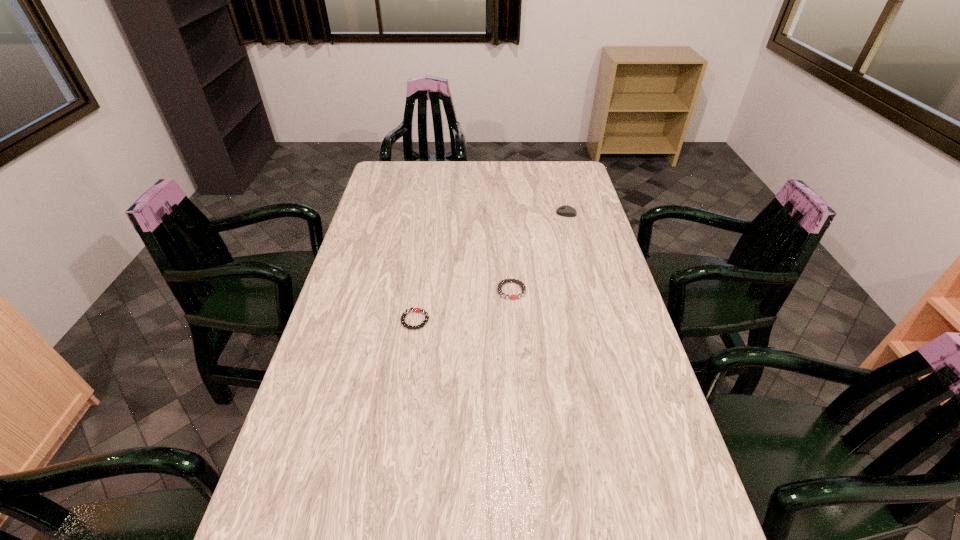
Locate an element on the screen. Image resolution: width=960 pixels, height=540 pixels. empty location between the farther bracelet and the leftmost object is located at coordinates (464, 305).

Where is `empty space that is in between the nearest object and the right bracelet`? This screenshot has height=540, width=960. empty space that is in between the nearest object and the right bracelet is located at coordinates (464, 305).

Where is `free space that is in between the tallest object and the nearest object`? The width and height of the screenshot is (960, 540). free space that is in between the tallest object and the nearest object is located at coordinates (491, 267).

Locate an element on the screen. This screenshot has width=960, height=540. vacant area that lies between the rightmost object and the farther bracelet is located at coordinates (539, 252).

The width and height of the screenshot is (960, 540). I want to click on object that is the closest one to the nearer bracelet, so click(x=509, y=280).

Identify which object is the closest to the tallest object. Please provide its 2D coordinates. Your answer should be formatted as a tuple, i.e. [(x, y)], where the tuple contains the x and y coordinates of a point satisfying the conditions above.

[(509, 280)]

Identify the location of vacant space that satisfies the following two spatial constraints: 1. on the back side of the left bracelet; 2. on the left side of the right bracelet. (420, 291).